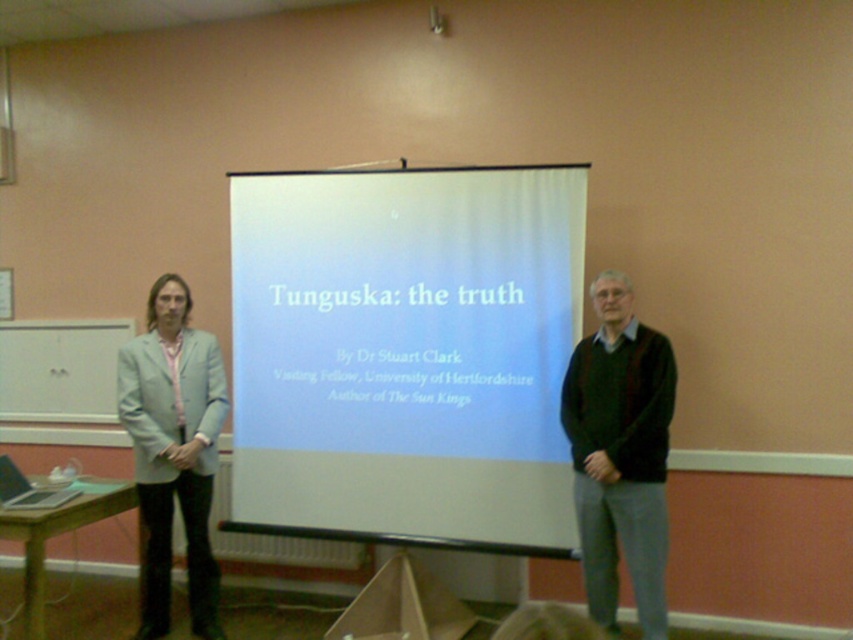
You are an event organizer setting up a presentation. You need to ensure that the white matte projection screen at center is visible to all attendees. Given that the dark green sweater at center is currently blocking part of the screen, can you determine if the screen is still mostly visible?

The white matte projection screen at center is bigger than the dark green sweater at center, so even if the sweater is blocking part of it, the screen is still mostly visible.

You are a student in the classroom and need to determine which clothing item has a narrower width between the dark green sweater at center and the light blue fabric jacket at left. Which one is narrower?

The dark green sweater at center has a narrower width than the light blue fabric jacket at left according to the description.

You are a student sitting in the classroom and notice a specific point on the projection screen. What object is located at the coordinates point (x=405, y=353) on the white matte projection screen at center?

The point (x=405, y=353) is located on the white matte projection screen at center, which displays text about the presentation titled Tunguska the truth by Dr. Stuart Clark.